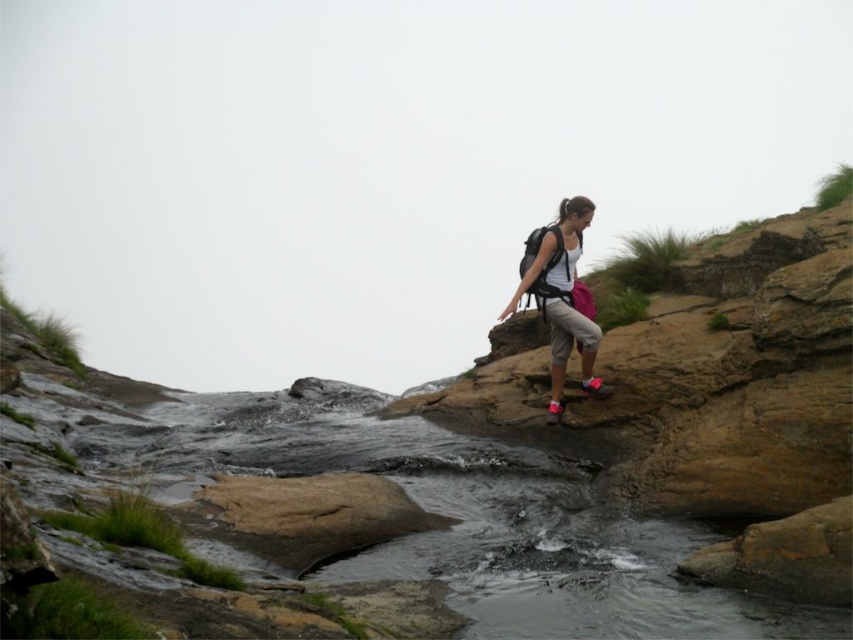
Between white fabric backpack at center-right and matte black backpack at upper right, which one is positioned lower?

white fabric backpack at center-right

Who is taller, white fabric backpack at center-right or matte black backpack at upper right?

Standing taller between the two is white fabric backpack at center-right.

Image resolution: width=853 pixels, height=640 pixels. I want to click on white fabric backpack at center-right, so click(560, 296).

Describe the element at coordinates (480, 520) in the screenshot. I see `clear water at center` at that location.

Between clear water at center and matte black backpack at upper right, which one appears on the right side from the viewer's perspective?

matte black backpack at upper right

What do you see at coordinates (480, 520) in the screenshot? I see `clear water at center` at bounding box center [480, 520].

Identify the location of clear water at center. The image size is (853, 640). (480, 520).

Which is behind, point (498, 561) or point (579, 310)?

The point (579, 310) is behind.

Does point (492, 586) come farther from viewer compared to point (526, 260)?

No, (492, 586) is closer to viewer.

This screenshot has width=853, height=640. I want to click on clear water at center, so (480, 520).

Locate an element on the screen. The image size is (853, 640). clear water at center is located at coordinates (480, 520).